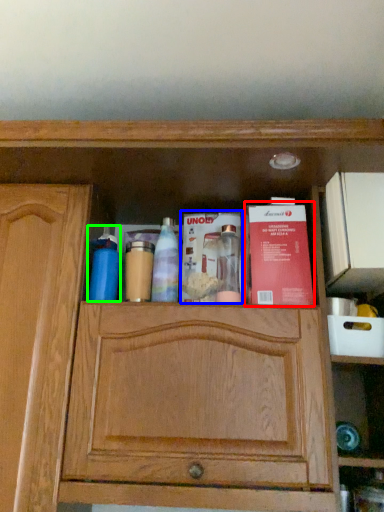
Question: Which is farther away from book (highlighted by a red box)? book (highlighted by a blue box) or cleaning product (highlighted by a green box)?

Choices:
 (A) book
 (B) cleaning product

Answer: (B)